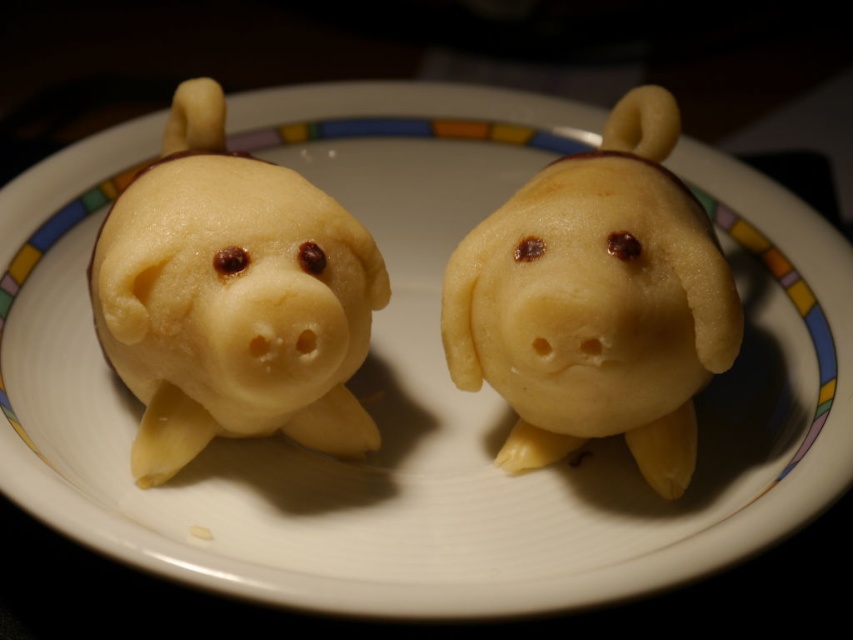
Question: Is matte yellow pastry at left above yellow matte piglet at center?

Choices:
 (A) yes
 (B) no

Answer: (B)

Question: Observing the image, what is the correct spatial positioning of matte yellow pastry at left in reference to yellow matte piglet at center?

Choices:
 (A) right
 (B) left

Answer: (B)

Question: Which of the following is the closest to the observer?

Choices:
 (A) yellow matte piglet at center
 (B) matte yellow pastry at left

Answer: (B)

Question: Which of the following is the farthest from the observer?

Choices:
 (A) (583, 422)
 (B) (169, 243)

Answer: (A)

Question: Is matte yellow pastry at left positioned before yellow matte piglet at center?

Choices:
 (A) no
 (B) yes

Answer: (B)